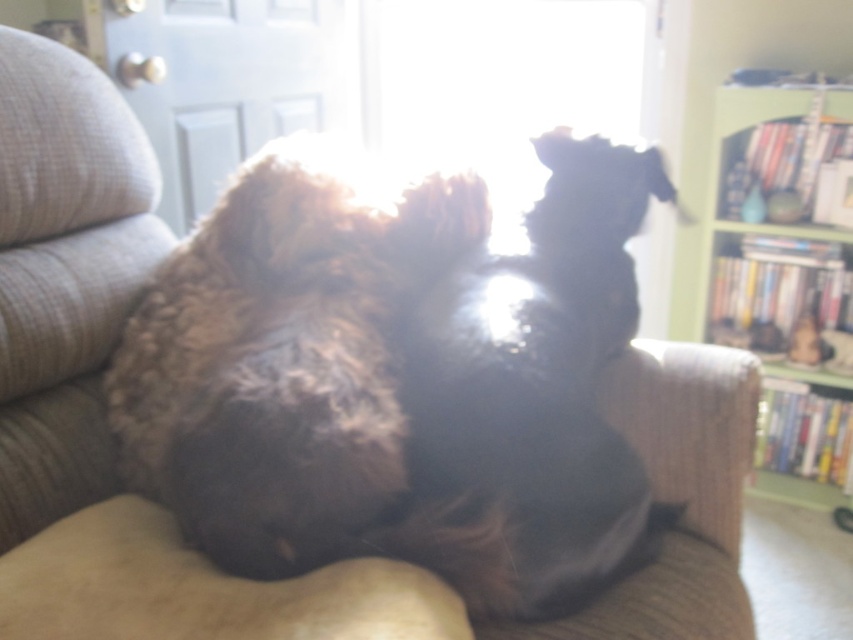
Question: Is fuzzy brown dog at center thinner than shiny black dog at center?

Choices:
 (A) yes
 (B) no

Answer: (B)

Question: Which point is closer to the camera?

Choices:
 (A) (422, 509)
 (B) (236, 224)

Answer: (A)

Question: Is shiny black dog at center above green wooden bookshelf at right?

Choices:
 (A) no
 (B) yes

Answer: (A)

Question: Can you confirm if fuzzy brown dog at center is positioned above green wooden bookshelf at right?

Choices:
 (A) yes
 (B) no

Answer: (B)

Question: Among these points, which one is nearest to the camera?

Choices:
 (A) (508, 406)
 (B) (762, 326)

Answer: (A)

Question: Which object is the closest to the green wooden bookshelf at right?

Choices:
 (A) fuzzy brown dog at center
 (B) shiny black dog at center

Answer: (B)